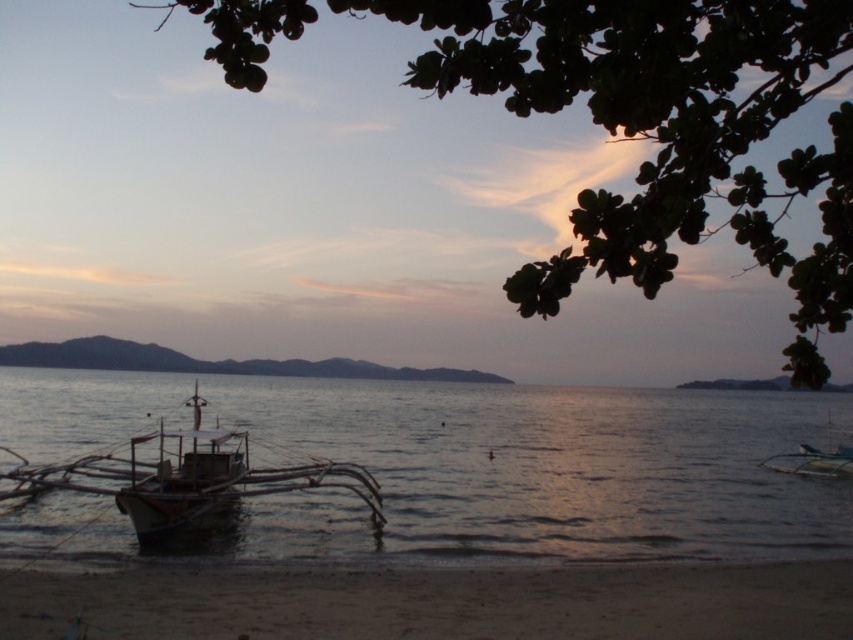
Question: Is sandy beach at lower left closer to the viewer compared to wooden boat at lower left?

Choices:
 (A) no
 (B) yes

Answer: (B)

Question: Is white matte water at lower left further to the viewer compared to sandy beach at lower left?

Choices:
 (A) yes
 (B) no

Answer: (A)

Question: Which object is positioned farthest from the wooden boat at lower left?

Choices:
 (A) sandy beach at lower left
 (B) green leafy tree at upper center

Answer: (B)

Question: Which point is closer to the camera taking this photo?

Choices:
 (A) (782, 52)
 (B) (296, 621)

Answer: (A)

Question: Which is nearer to the white matte water at lower left?

Choices:
 (A) sandy beach at lower left
 (B) wooden boat at lower left
 (C) wooden sailboat at right
 (D) green leafy tree at upper center

Answer: (B)

Question: Is wooden boat at lower left smaller than wooden sailboat at right?

Choices:
 (A) yes
 (B) no

Answer: (B)